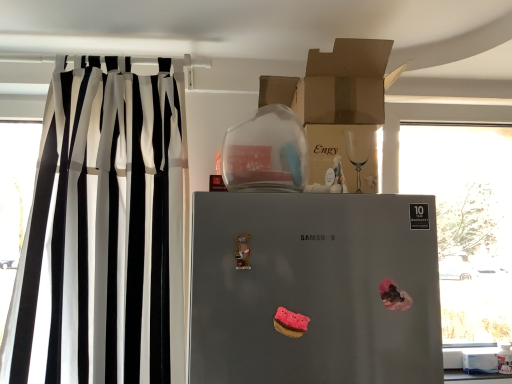
Question: Considering the relative sizes of satin silver refrigerator at center and transparent glass window at right in the image provided, is satin silver refrigerator at center bigger than transparent glass window at right?

Choices:
 (A) no
 (B) yes

Answer: (B)

Question: Can you confirm if satin silver refrigerator at center is thinner than transparent glass window at right?

Choices:
 (A) yes
 (B) no

Answer: (B)

Question: Is satin silver refrigerator at center not inside transparent glass window at right?

Choices:
 (A) no
 (B) yes

Answer: (B)

Question: Is satin silver refrigerator at center next to transparent glass window at right and touching it?

Choices:
 (A) no
 (B) yes

Answer: (A)

Question: Is transparent glass window at right inside satin silver refrigerator at center?

Choices:
 (A) no
 (B) yes

Answer: (A)

Question: Is cardboard box at upper center, which is the 1th cardboard box in top-to-bottom order, spatially inside pink felt donut at center, the second stuff when ordered from left to right, or outside of it?

Choices:
 (A) inside
 (B) outside

Answer: (B)

Question: Is point (362, 44) closer or farther from the camera than point (407, 299)?

Choices:
 (A) closer
 (B) farther

Answer: (B)

Question: Visually, is cardboard box at upper center, which is the 1th cardboard box in top-to-bottom order, positioned to the left or to the right of pink felt donut at center, the second stuff when ordered from left to right?

Choices:
 (A) left
 (B) right

Answer: (A)

Question: Considering the positions of cardboard box at upper center, which is the 1th cardboard box in top-to-bottom order, and pink felt donut at center, which is counted as the 1th stuff, starting from the top, in the image, is cardboard box at upper center, which is the 1th cardboard box in top-to-bottom order, bigger or smaller than pink felt donut at center, which is counted as the 1th stuff, starting from the top,?

Choices:
 (A) small
 (B) big

Answer: (B)

Question: Is point (396, 289) closer or farther from the camera than point (314, 49)?

Choices:
 (A) closer
 (B) farther

Answer: (A)

Question: Is pink felt donut at center, which appears as the 2th stuff when ordered from the bottom, to the left or to the right of cardboard box at upper center, which is the 1th cardboard box in top-to-bottom order, in the image?

Choices:
 (A) left
 (B) right

Answer: (B)

Question: Is pink felt donut at center, which appears as the 2th stuff when ordered from the bottom, taller or shorter than cardboard box at upper center, arranged as the second cardboard box when ordered from the bottom?

Choices:
 (A) tall
 (B) short

Answer: (B)

Question: In the image, is pink felt donut at center, acting as the 2th stuff starting from the front, positioned in front of or behind cardboard box at upper center, arranged as the second cardboard box when ordered from the bottom?

Choices:
 (A) behind
 (B) front

Answer: (B)

Question: Visually, is black/white striped curtain at left positioned to the left or to the right of white cardboard box at lower right?

Choices:
 (A) right
 (B) left

Answer: (B)

Question: Is black/white striped curtain at left wider or thinner than white cardboard box at lower right?

Choices:
 (A) wide
 (B) thin

Answer: (A)